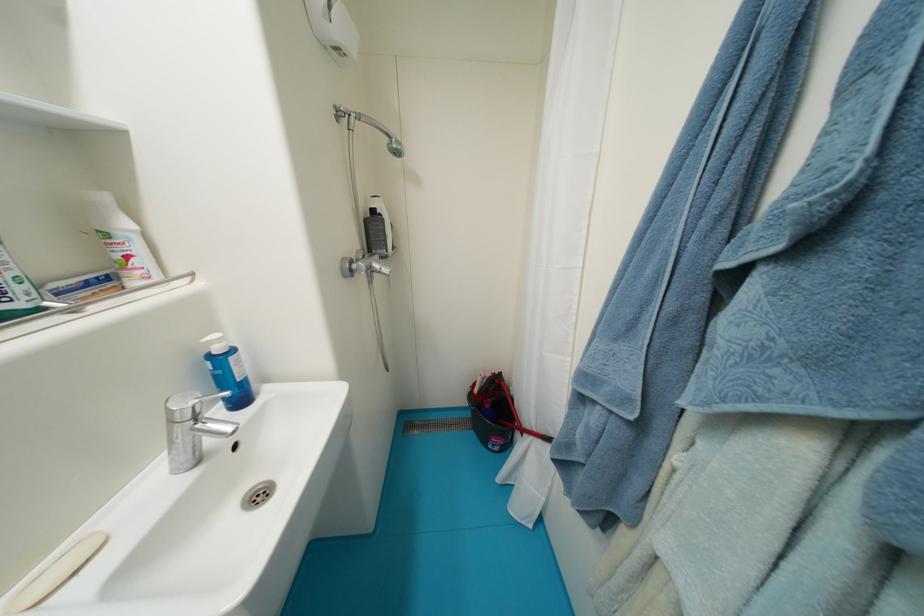
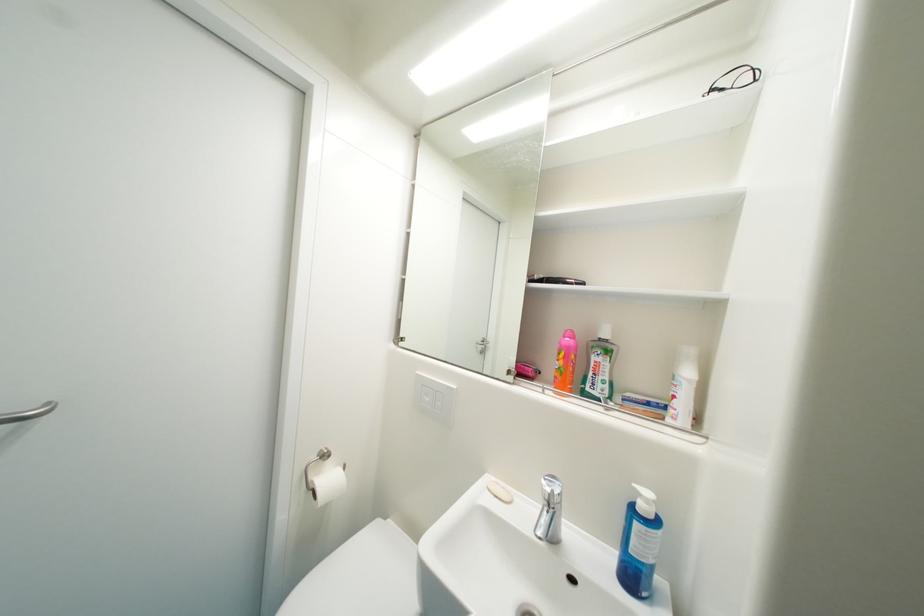
In the second image, find the point that corresponds to point 61,286 in the first image.

(635, 397)